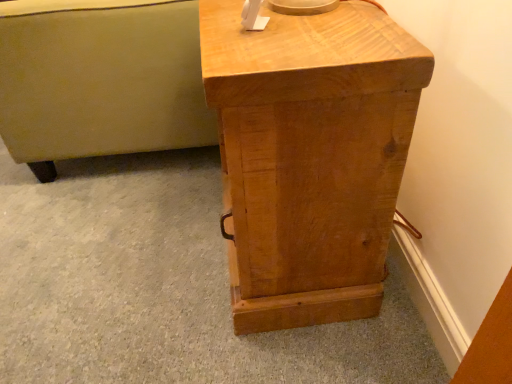
This screenshot has width=512, height=384. Describe the element at coordinates (310, 155) in the screenshot. I see `light brown wood nightstand at center` at that location.

Where is `light brown wood nightstand at center`? This screenshot has width=512, height=384. light brown wood nightstand at center is located at coordinates (310, 155).

What do you see at coordinates (100, 80) in the screenshot? I see `matte beige ottoman at left` at bounding box center [100, 80].

Locate an element on the screen. This screenshot has height=384, width=512. matte beige ottoman at left is located at coordinates (100, 80).

Locate an element on the screen. light brown wood nightstand at center is located at coordinates (310, 155).

Based on the photo, considering the positions of objects light brown wood nightstand at center and matte beige ottoman at left in the image provided, who is more to the right, light brown wood nightstand at center or matte beige ottoman at left?

From the viewer's perspective, light brown wood nightstand at center appears more on the right side.

Is light brown wood nightstand at center behind matte beige ottoman at left?

No, the depth of light brown wood nightstand at center is less than that of matte beige ottoman at left.

Which is further, (306, 312) or (3, 36)?

The point (3, 36) is farther from the camera.

From the image's perspective, is light brown wood nightstand at center positioned above or below matte beige ottoman at left?

light brown wood nightstand at center is situated lower than matte beige ottoman at left in the image.

From a real-world perspective, which object rests below the other?

matte beige ottoman at left.

Looking at their sizes, would you say light brown wood nightstand at center is wider or thinner than matte beige ottoman at left?

Clearly, light brown wood nightstand at center has less width compared to matte beige ottoman at left.

In terms of height, does light brown wood nightstand at center look taller or shorter compared to matte beige ottoman at left?

light brown wood nightstand at center is taller than matte beige ottoman at left.

Does light brown wood nightstand at center have a smaller size compared to matte beige ottoman at left?

Correct, light brown wood nightstand at center occupies less space than matte beige ottoman at left.

Is light brown wood nightstand at center spatially inside matte beige ottoman at left, or outside of it?

The correct answer is: outside.

Is light brown wood nightstand at center not close to matte beige ottoman at left?

No, light brown wood nightstand at center is not far from matte beige ottoman at left.

Is light brown wood nightstand at center oriented towards matte beige ottoman at left?

No, light brown wood nightstand at center is not aimed at matte beige ottoman at left.

In the scene shown: How many degrees apart are the facing directions of light brown wood nightstand at center and matte beige ottoman at left?

The angle between the facing direction of light brown wood nightstand at center and the facing direction of matte beige ottoman at left is 0.535 degrees.

You are a GUI agent. You are given a task and a screenshot of the screen. Output one action in this format:
    pyautogui.click(x=<x>, y=<y>)
    Task: Click on the furniture lying behind the light brown wood nightstand at center
    This screenshot has height=384, width=512.
    Given the screenshot: What is the action you would take?
    pyautogui.click(x=100, y=80)

In the image, is matte beige ottoman at left on the left side or the right side of light brown wood nightstand at center?

From the image, it's evident that matte beige ottoman at left is to the left of light brown wood nightstand at center.

Between matte beige ottoman at left and light brown wood nightstand at center, which one is positioned in front?

light brown wood nightstand at center is closer to the camera.

Does point (10, 86) come farther from viewer compared to point (395, 115)?

Yes, it is.

From the image's perspective, which one is positioned lower, matte beige ottoman at left or light brown wood nightstand at center?

From the image's view, light brown wood nightstand at center is below.

From a real-world perspective, is matte beige ottoman at left positioned over light brown wood nightstand at center based on gravity?

No, from a real-world perspective, matte beige ottoman at left is not above light brown wood nightstand at center.

Does matte beige ottoman at left have a lesser width compared to light brown wood nightstand at center?

No.

Considering the sizes of objects matte beige ottoman at left and light brown wood nightstand at center in the image provided, who is shorter, matte beige ottoman at left or light brown wood nightstand at center?

matte beige ottoman at left is shorter.

Is matte beige ottoman at left smaller than light brown wood nightstand at center?

No.

Would you say matte beige ottoman at left is outside light brown wood nightstand at center?

Yes.

Is the surface of matte beige ottoman at left in direct contact with light brown wood nightstand at center?

matte beige ottoman at left and light brown wood nightstand at center are not in contact.

Does matte beige ottoman at left turn towards light brown wood nightstand at center?

No, matte beige ottoman at left is not facing towards light brown wood nightstand at center.

What's the angular difference between matte beige ottoman at left and light brown wood nightstand at center's facing directions?

The angle between the facing direction of matte beige ottoman at left and the facing direction of light brown wood nightstand at center is 0.535 degrees.

The height and width of the screenshot is (384, 512). I want to click on furniture that appears below the light brown wood nightstand at center (from a real-world perspective), so click(100, 80).

The width and height of the screenshot is (512, 384). In the image, there is a light brown wood nightstand at center. Identify the location of furniture below it (from a real-world perspective). [100, 80].

You are a GUI agent. You are given a task and a screenshot of the screen. Output one action in this format:
    pyautogui.click(x=<x>, y=<y>)
    Task: Click on the nightstand below the matte beige ottoman at left (from the image's perspective)
    
    Given the screenshot: What is the action you would take?
    pyautogui.click(x=310, y=155)